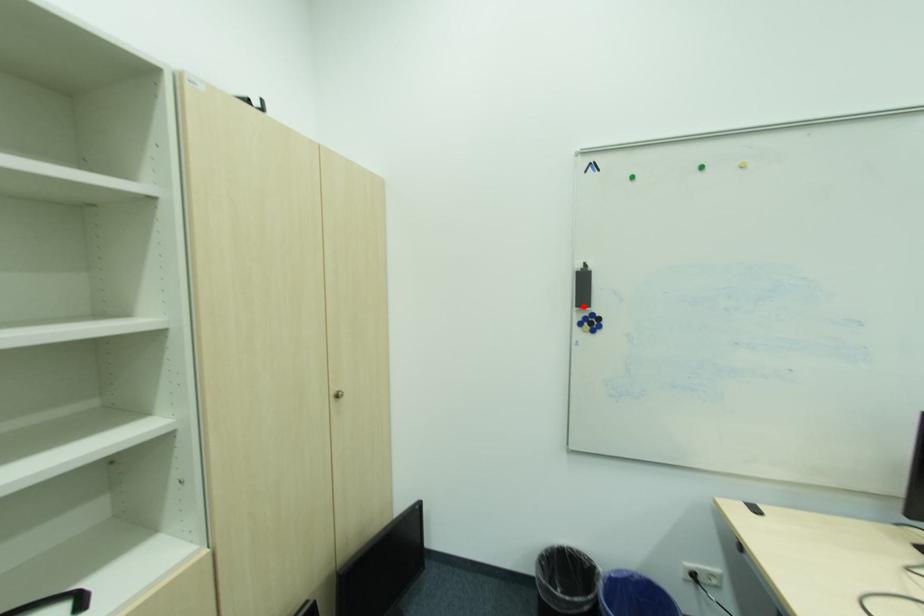
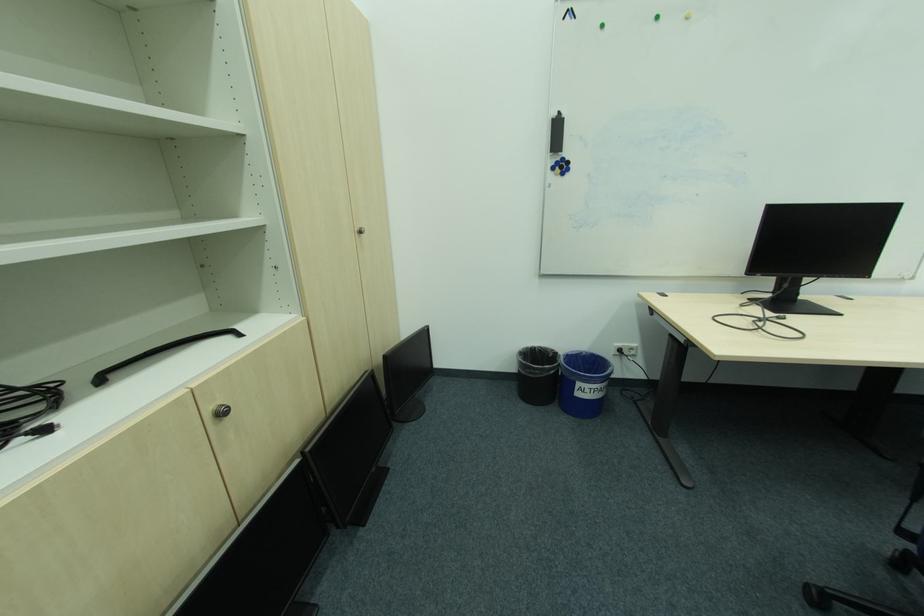
In the second image, find the point that corresponds to the highlighted location in the first image.

(558, 152)